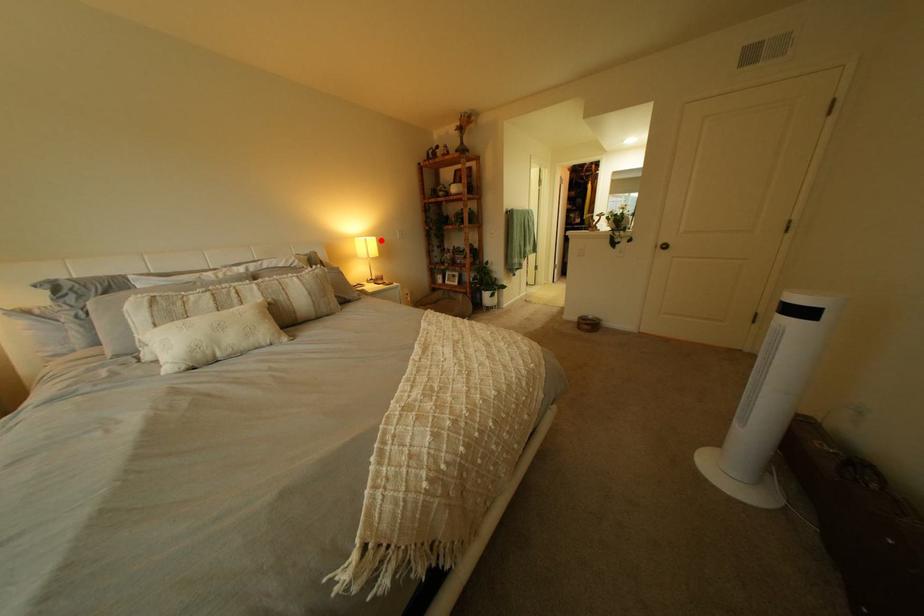
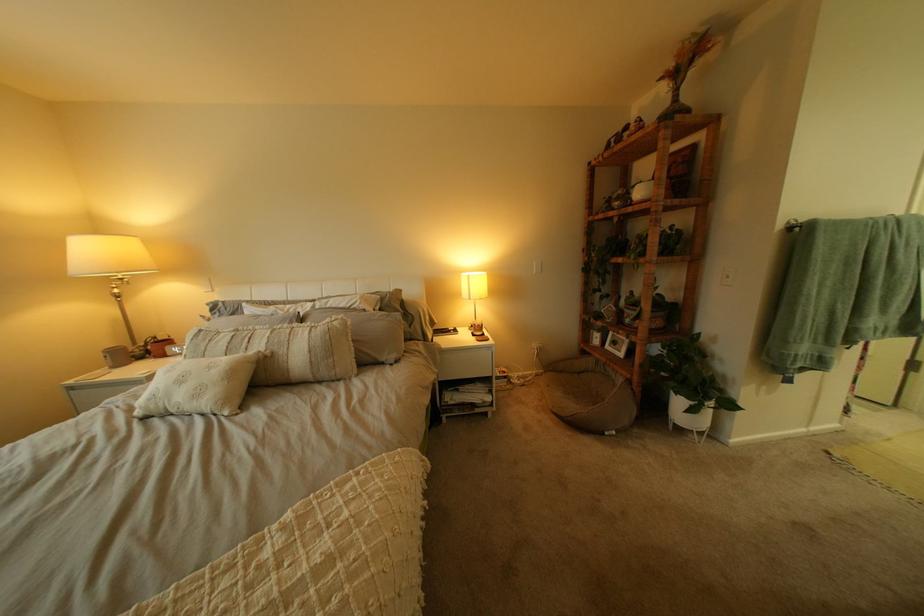
Find the pixel in the second image that matches the highlighted location in the first image.

(483, 277)